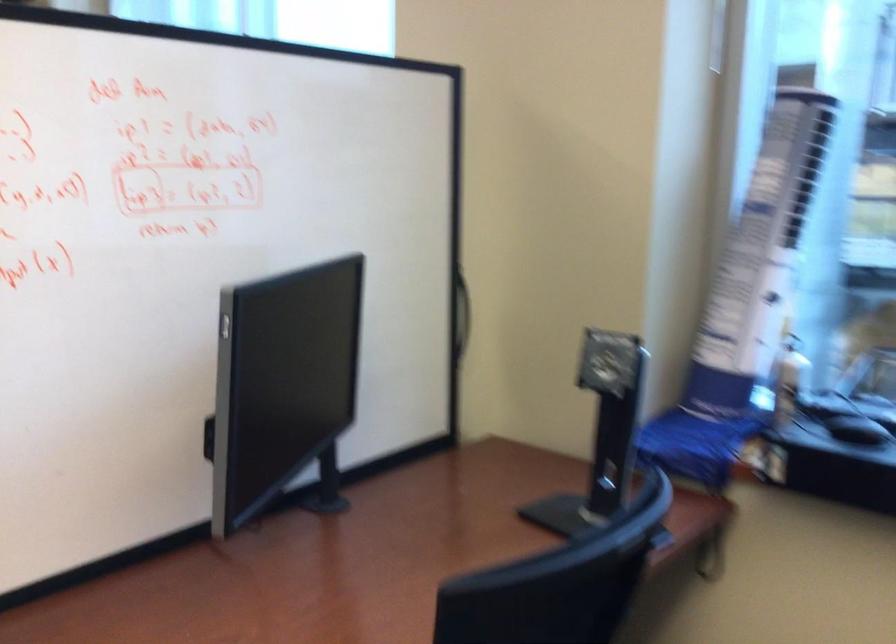
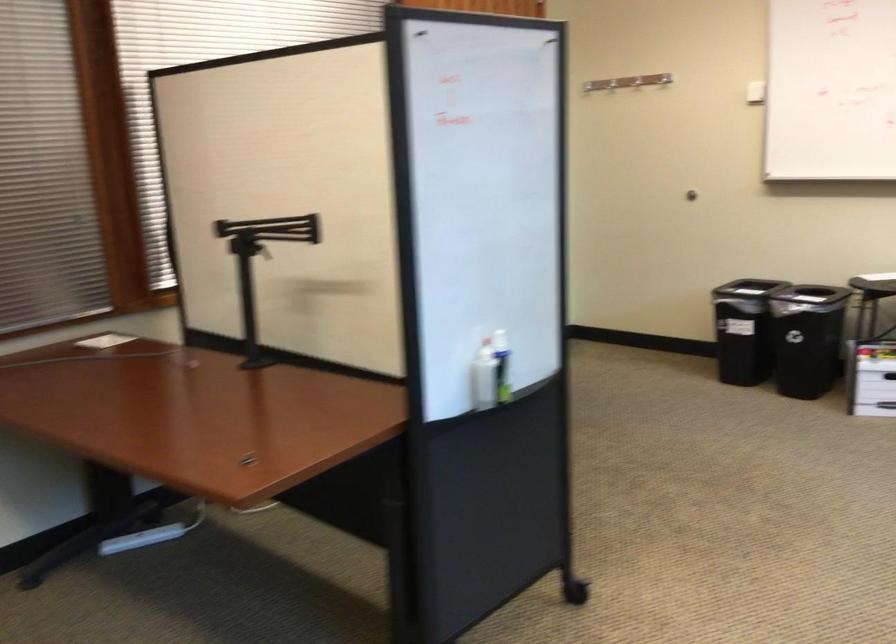
Question: The camera is either moving clockwise (left) or counter-clockwise (right) around the object. The first image is from the beginning of the video and the second image is from the end. Is the camera moving left or right when shooting the video?

Choices:
 (A) Left
 (B) Right

Answer: (B)